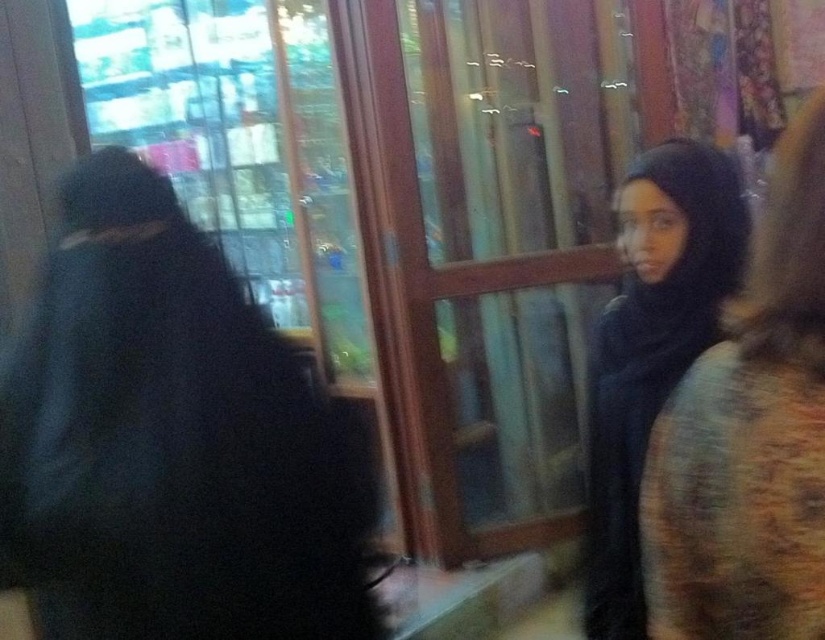
Question: Does black matte coat at left come behind black matte hijab at right?

Choices:
 (A) yes
 (B) no

Answer: (B)

Question: Based on their relative distances, which object is nearer to the black matte hijab at upper right?

Choices:
 (A) black matte coat at left
 (B) transparent glass door at center

Answer: (A)

Question: Is black matte coat at left to the right of black matte hijab at upper right from the viewer's perspective?

Choices:
 (A) yes
 (B) no

Answer: (B)

Question: Which of the following is the farthest from the observer?

Choices:
 (A) transparent glass door at center
 (B) black matte hijab at right

Answer: (A)

Question: Is transparent glass door at center to the right of black matte hijab at right from the viewer's perspective?

Choices:
 (A) yes
 (B) no

Answer: (B)

Question: Estimate the real-world distances between objects in this image. Which object is closer to the transparent glass door at center?

Choices:
 (A) black matte hijab at right
 (B) black matte coat at left
 (C) black matte hijab at upper right

Answer: (A)